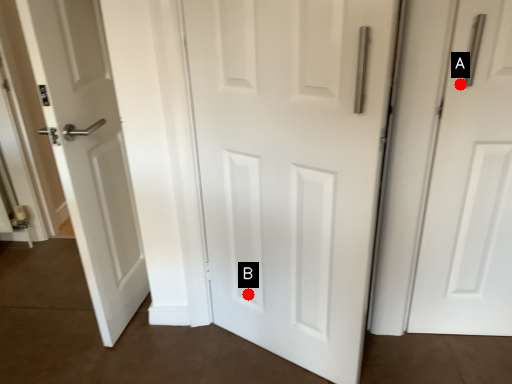
Question: Two points are circled on the image, labeled by A and B beside each circle. Which point is farther to the camera?

Choices:
 (A) A is further
 (B) B is further

Answer: (B)